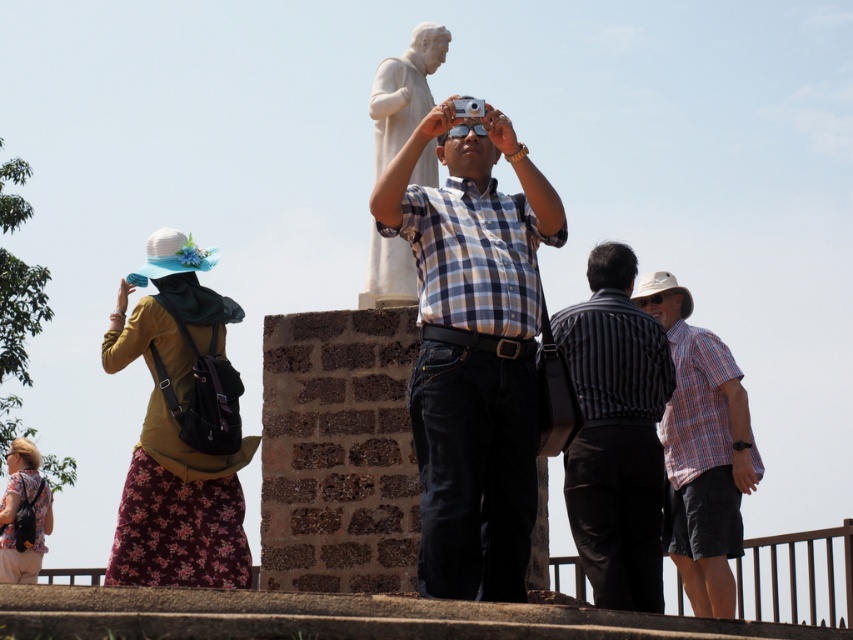
Question: Observing the image, what is the correct spatial positioning of matte yellow shirt at upper left in reference to plaid shirt at center?

Choices:
 (A) right
 (B) left

Answer: (B)

Question: Which point is farther to the camera?

Choices:
 (A) striped shirt at center
 (B) matte black backpack at lower left

Answer: (B)

Question: Which of the following is the closest to the observer?

Choices:
 (A) (405, 282)
 (B) (602, 243)
 (C) (665, 321)
 (D) (180, 426)

Answer: (D)

Question: Which point is closer to the camera?

Choices:
 (A) (376, 177)
 (B) (157, 577)
 (C) (51, 524)
 (D) (505, 586)

Answer: (D)

Question: Can you confirm if checkered shirt at center is positioned to the left of striped shirt at center?

Choices:
 (A) yes
 (B) no

Answer: (A)

Question: Is plaid shirt at center smaller than white marble statue at center?

Choices:
 (A) no
 (B) yes

Answer: (A)